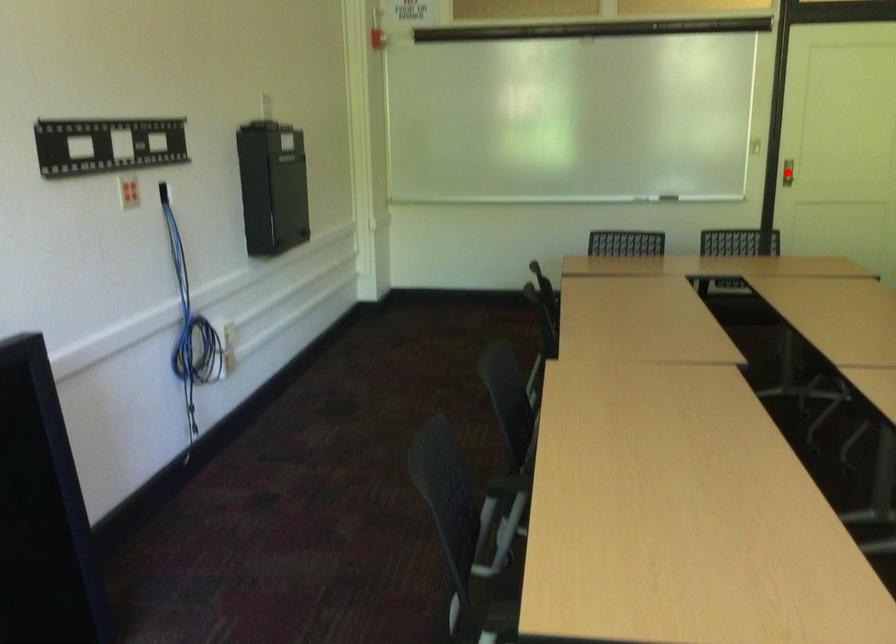
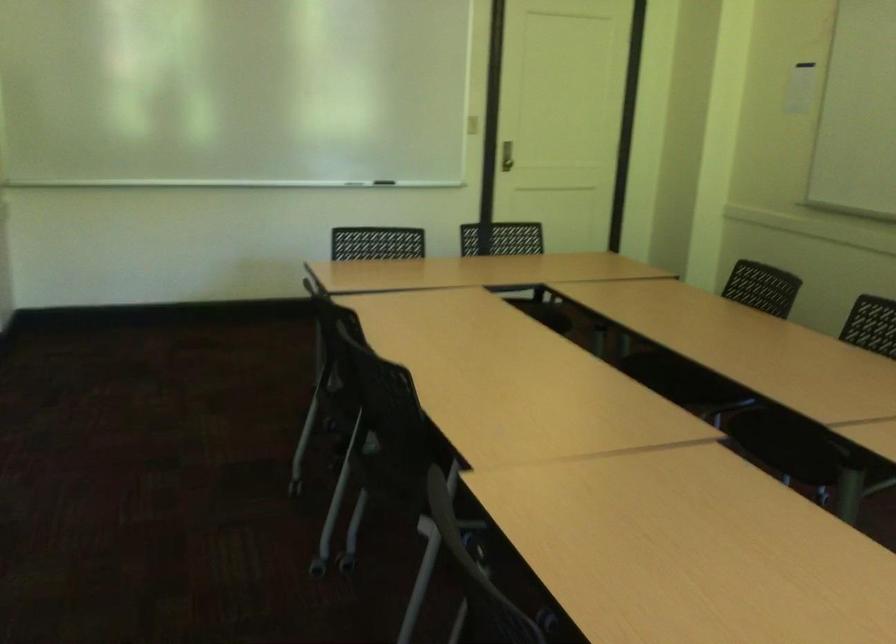
Question: I am providing you with two images of the same scene from different viewpoints. A red point is marked on the first image. At the location where the point appears in image 1, is it still visible in image 2?

Choices:
 (A) Yes
 (B) No

Answer: (B)